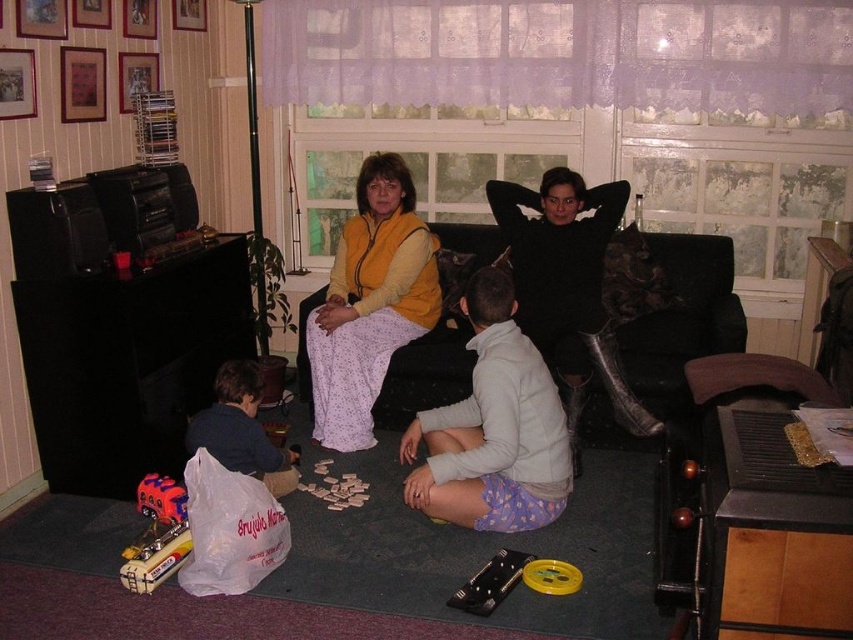
You are a guest in this living room and want to place a small plant between the light gray fleece at center and the yellow plastic spool at lower center. Considering their heights, which object should the plant be placed closer to to ensure it doesn

The light gray fleece at center is much taller than the yellow plastic spool at lower center. To ensure the plant is visible and balanced, it should be placed closer to the shorter yellow plastic spool at lower center.

Consider the image. You are organizing a small play area in the living room and need to place a light gray fleece at center and a yellow plastic spool at lower center. Since space is limited, you want to know which item takes up more horizontal space. Which object is wider?

The light gray fleece at center is wider than the yellow plastic spool at lower center because its width is larger.

Based on the photo, you are standing at the point with coordinates point (x=253, y=376). You want to move to the point with coordinates point (x=610, y=269). Which direction should you move in?

You should move backward to reach point (x=610, y=269) from point (x=253, y=376) because point (x=610, y=269) is behind point (x=253, y=376).